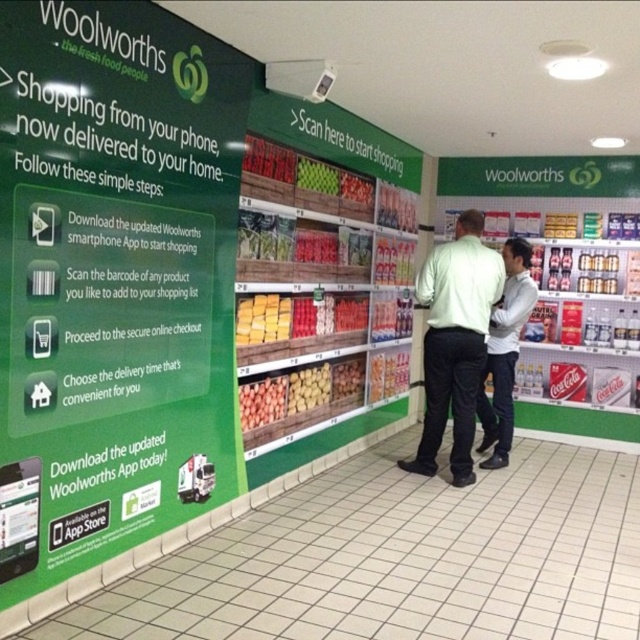
Which is more to the left, light green shirt at center or white shirt at center?

Positioned to the left is light green shirt at center.

Can you confirm if light green shirt at center is wider than white shirt at center?

Correct, the width of light green shirt at center exceeds that of white shirt at center.

Image resolution: width=640 pixels, height=640 pixels. What do you see at coordinates (454, 342) in the screenshot?
I see `light green shirt at center` at bounding box center [454, 342].

Locate an element on the screen. The image size is (640, 640). light green shirt at center is located at coordinates (454, 342).